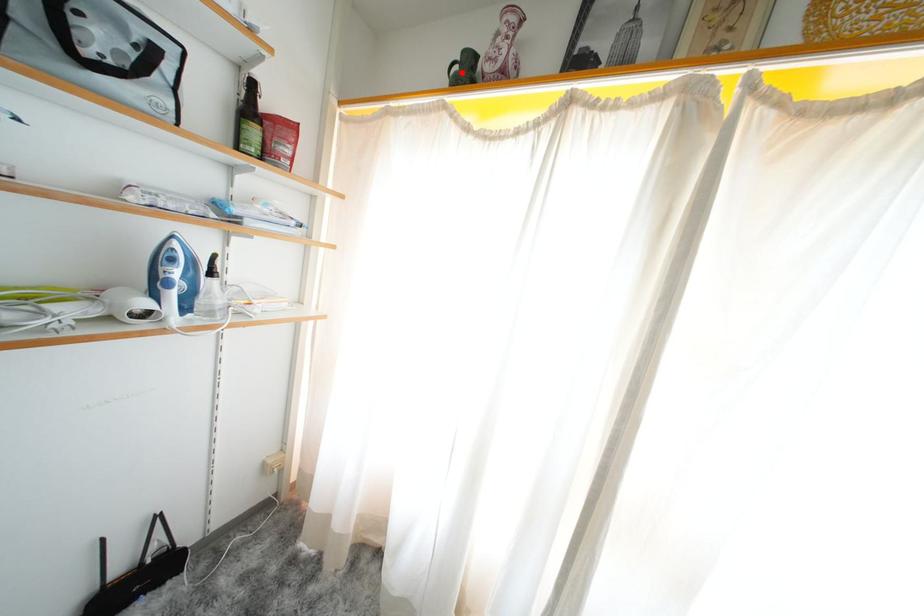
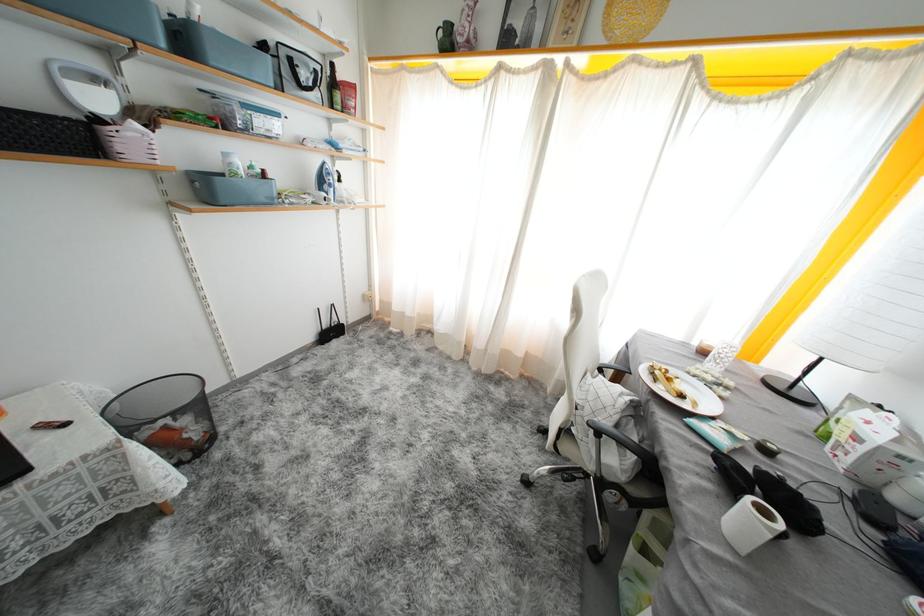
Question: I am providing you with two images of the same scene from different viewpoints. A red point is marked on the first image. Is the red point's position out of view in image 2?

Choices:
 (A) Yes
 (B) No

Answer: (B)